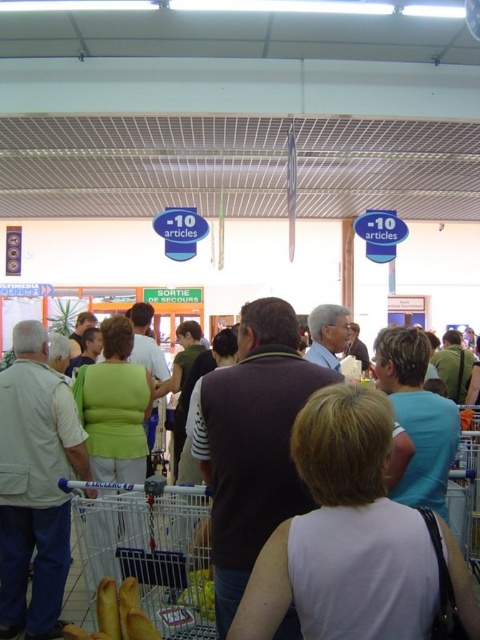
Does point (338, 580) come in front of point (327, 342)?

Yes, it is in front of point (327, 342).

Measure the distance between white matte shirt at center and camera.

white matte shirt at center and camera are 4.32 feet apart.

At what (x,y) coordinates should I click in order to perform the action: click on white matte shirt at center. Please return your answer as a coordinate pair (x, y). This screenshot has width=480, height=640. Looking at the image, I should click on (344, 536).

Who is lower down, white matte shirt at center or metallic silver shopping cart at lower left?

metallic silver shopping cart at lower left

Can you confirm if white matte shirt at center is smaller than metallic silver shopping cart at lower left?

Correct, white matte shirt at center occupies less space than metallic silver shopping cart at lower left.

Locate an element on the screen. white matte shirt at center is located at coordinates (344, 536).

Does green matte shirt at center appear on the right side of light blue fabric shirt at center?

No, green matte shirt at center is not to the right of light blue fabric shirt at center.

Is green matte shirt at center above light blue fabric shirt at center?

Actually, green matte shirt at center is below light blue fabric shirt at center.

Is point (113, 534) more distant than point (431, 397)?

Yes, point (113, 534) is farther from viewer.

Where is `green matte shirt at center`? The image size is (480, 640). green matte shirt at center is located at coordinates (115, 406).